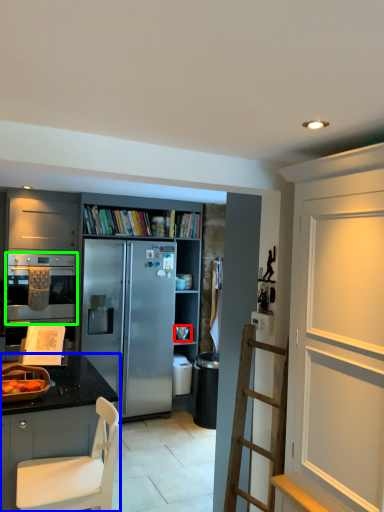
Question: Considering the real-world distances, which object is farthest from appliance (highlighted by a red box)? cabinetry (highlighted by a blue box) or oven (highlighted by a green box)?

Choices:
 (A) cabinetry
 (B) oven

Answer: (A)